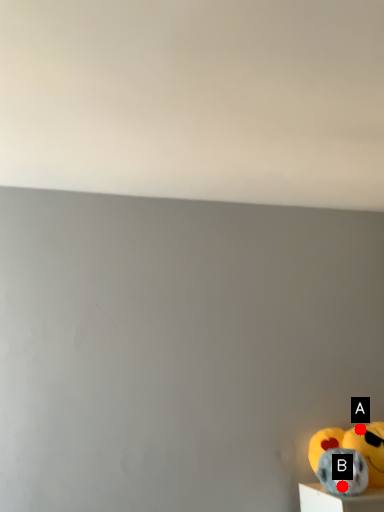
Question: Two points are circled on the image, labeled by A and B beside each circle. Which of the following is the closest to the observer?

Choices:
 (A) A is closer
 (B) B is closer

Answer: (B)